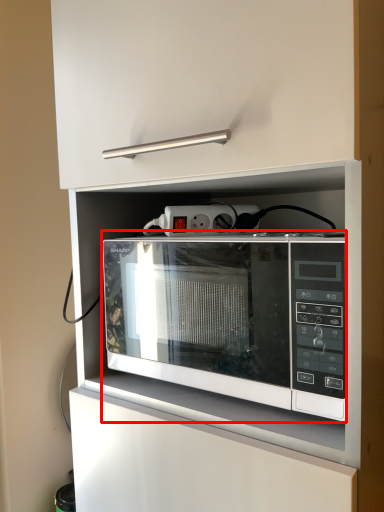
Question: Where is microwave oven (annotated by the red box) located in relation to electric outlet in the image?

Choices:
 (A) left
 (B) right

Answer: (B)